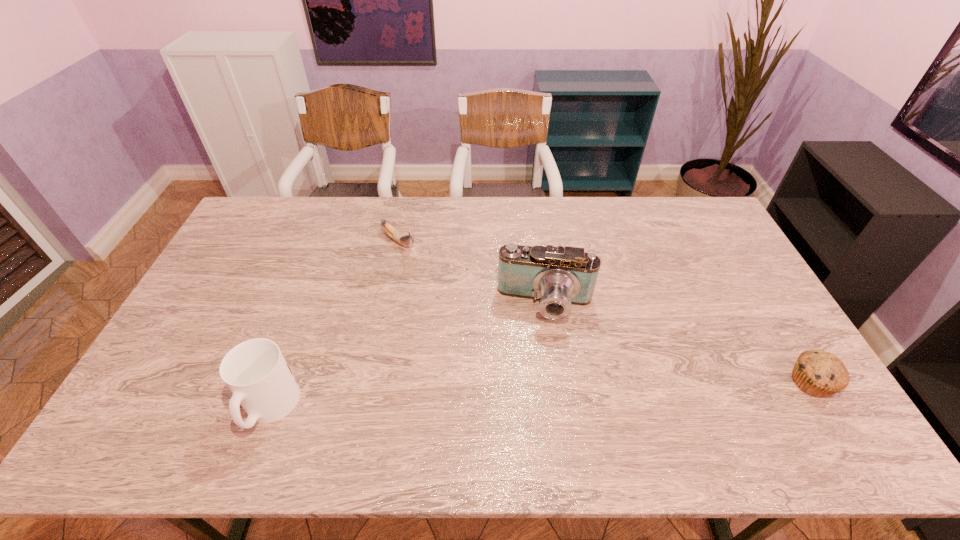
Locate an element on the screen. vacant space at the left edge of the desktop is located at coordinates (256, 261).

The height and width of the screenshot is (540, 960). Identify the location of vacant area at the right edge of the desktop. (721, 308).

Locate an element on the screen. This screenshot has height=540, width=960. vacant point located between the second farthest object and the farthest object is located at coordinates (472, 272).

You are a GUI agent. You are given a task and a screenshot of the screen. Output one action in this format:
    pyautogui.click(x=<x>, y=<y>)
    Task: Click on the vacant point located between the muffin and the mug
    The height and width of the screenshot is (540, 960).
    Given the screenshot: What is the action you would take?
    pyautogui.click(x=541, y=395)

Locate an element on the screen. vacant area that lies between the rightmost object and the farthest object is located at coordinates (605, 312).

Locate an element on the screen. This screenshot has height=540, width=960. free spot between the farthest object and the rightmost object is located at coordinates (605, 312).

Identify the location of free space between the rightmost object and the mug. (541, 395).

Where is `vacant space that's between the third nearest object and the banana`? vacant space that's between the third nearest object and the banana is located at coordinates (472, 272).

Locate an element on the screen. empty space between the third nearest object and the second object from left to right is located at coordinates (472, 272).

This screenshot has width=960, height=540. I want to click on vacant point located between the muffin and the camcorder, so click(x=679, y=342).